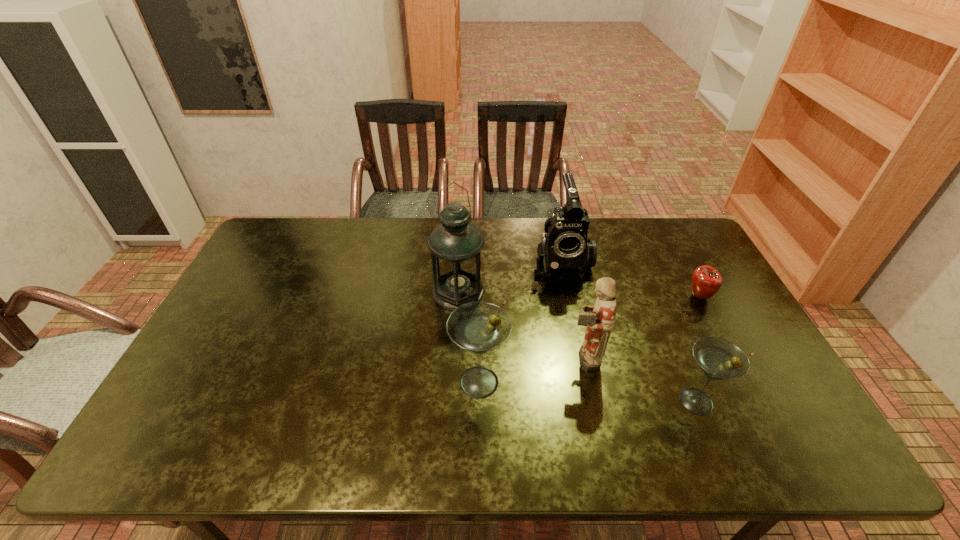
In order to click on free space at the left edge in this screenshot , I will do `click(187, 383)`.

I want to click on vacant space at the right edge of the desktop, so click(681, 295).

At what (x,y) coordinates should I click in order to perform the action: click on vacant space at the far left corner of the desktop. Please return your answer as a coordinate pair (x, y). Looking at the image, I should click on (276, 242).

This screenshot has height=540, width=960. I want to click on unoccupied position between the figurine and the apple, so click(x=641, y=327).

I want to click on vacant space that's between the figurine and the rightmost object, so click(641, 327).

The width and height of the screenshot is (960, 540). I want to click on free space between the right martini and the camcorder, so click(629, 333).

Image resolution: width=960 pixels, height=540 pixels. Find the location of `free spot between the camcorder and the figurine`. free spot between the camcorder and the figurine is located at coordinates (572, 310).

Locate an element on the screen. free space between the tallest object and the shortest object is located at coordinates (579, 294).

I want to click on free point between the second object from right to left and the taller martini, so click(588, 392).

Where is `free spot between the tallest object and the second shortest object`? The width and height of the screenshot is (960, 540). free spot between the tallest object and the second shortest object is located at coordinates (578, 347).